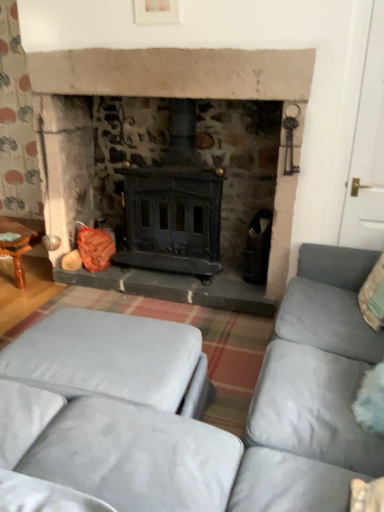
What is the approximate height of wooden table at left?

wooden table at left is 15.59 inches in height.

What is the approximate width of velvet grey couch at center?

It is 26.37 inches.

Locate an element on the screen. wooden table at left is located at coordinates (20, 241).

Considering the relative sizes of velvet grey ottoman at lower left and wooden table at left in the image provided, is velvet grey ottoman at lower left thinner than wooden table at left?

No, velvet grey ottoman at lower left is not thinner than wooden table at left.

How different are the orientations of velvet grey ottoman at lower left and wooden table at left in degrees?

The angular difference between velvet grey ottoman at lower left and wooden table at left is 179 degrees.

Does velvet grey ottoman at lower left appear on the left side of wooden table at left?

No.

Is wooden table at left at the back of velvet grey ottoman at lower left?

velvet grey ottoman at lower left is not turned away from wooden table at left.

Which object is wider, wooden table at left or velvet grey couch at center?

velvet grey couch at center.

Does wooden table at left have a greater height compared to velvet grey couch at center?

Incorrect, the height of wooden table at left is not larger of that of velvet grey couch at center.

Which is less distant, (7, 246) or (331, 264)?

Point (7, 246) appears to be farther away from the viewer than point (331, 264).

Is wooden table at left not near velvet grey couch at center?

Yes.

From their relative heights in the image, would you say velvet grey couch at center is taller or shorter than velvet grey ottoman at lower left?

Clearly, velvet grey couch at center is taller compared to velvet grey ottoman at lower left.

Is velvet grey couch at center oriented away from velvet grey ottoman at lower left?

velvet grey couch at center does not have its back to velvet grey ottoman at lower left.

Does velvet grey couch at center touch velvet grey ottoman at lower left?

velvet grey couch at center and velvet grey ottoman at lower left are clearly separated.

In terms of size, does velvet grey couch at center appear bigger or smaller than velvet grey ottoman at lower left?

Clearly, velvet grey couch at center is larger in size than velvet grey ottoman at lower left.

Is wooden table at left spatially inside velvet grey ottoman at lower left, or outside of it?

wooden table at left is located beyond the bounds of velvet grey ottoman at lower left.

Between wooden table at left and velvet grey ottoman at lower left, which one has more height?

velvet grey ottoman at lower left.

Which object is wider, wooden table at left or velvet grey ottoman at lower left?

With larger width is velvet grey ottoman at lower left.

The height and width of the screenshot is (512, 384). Identify the location of table on the left of velvet grey ottoman at lower left. (20, 241).

From a real-world perspective, is velvet grey ottoman at lower left physically located above or below velvet grey couch at center?

velvet grey ottoman at lower left is below velvet grey couch at center.

Considering the relative positions of velvet grey ottoman at lower left and velvet grey couch at center in the image provided, is velvet grey ottoman at lower left to the left or to the right of velvet grey couch at center?

Clearly, velvet grey ottoman at lower left is on the left of velvet grey couch at center in the image.

From the image's perspective, which object appears higher, velvet grey ottoman at lower left or velvet grey couch at center?

velvet grey couch at center.

Locate an element on the screen. This screenshot has height=512, width=384. studio couch located underneath the velvet grey couch at center (from a real-world perspective) is located at coordinates (113, 359).

Is velvet grey couch at center next to wooden table at left and touching it?

No, velvet grey couch at center is not next to wooden table at left.

Can you confirm if velvet grey couch at center is taller than wooden table at left?

Yes.

From a real-world perspective, is velvet grey couch at center positioned under wooden table at left based on gravity?

No.

What's the angular difference between velvet grey couch at center and wooden table at left's facing directions?

There is a 91.7-degree angle between the facing directions of velvet grey couch at center and wooden table at left.

At what (x,y) coordinates should I click in order to perform the action: click on table below the velvet grey ottoman at lower left (from a real-world perspective). Please return your answer as a coordinate pair (x, y). The width and height of the screenshot is (384, 512). Looking at the image, I should click on (20, 241).

The width and height of the screenshot is (384, 512). What are the coordinates of `table on the left of velvet grey couch at center` in the screenshot? It's located at (20, 241).

Looking at the image, which one is located further to wooden table at left, velvet grey couch at center or velvet grey ottoman at lower left?

The object further to wooden table at left is velvet grey couch at center.

Estimate the real-world distances between objects in this image. Which object is closer to wooden table at left, velvet grey ottoman at lower left or velvet grey couch at center?

Among the two, velvet grey ottoman at lower left is located nearer to wooden table at left.

In the scene shown: From the image, which object appears to be farther from velvet grey ottoman at lower left, velvet grey couch at center or wooden table at left?

wooden table at left.

From the image, which object appears to be farther from velvet grey couch at center, wooden table at left or velvet grey ottoman at lower left?

Based on the image, wooden table at left appears to be further to velvet grey couch at center.

Estimate the real-world distances between objects in this image. Which object is further from velvet grey ottoman at lower left, wooden table at left or velvet grey couch at center?

wooden table at left lies further to velvet grey ottoman at lower left than the other object.

Looking at the image, which one is located closer to velvet grey couch at center, velvet grey ottoman at lower left or wooden table at left?

velvet grey ottoman at lower left.

Locate an element on the screen. studio couch between velvet grey couch at center and wooden table at left in the front-back direction is located at coordinates (113, 359).